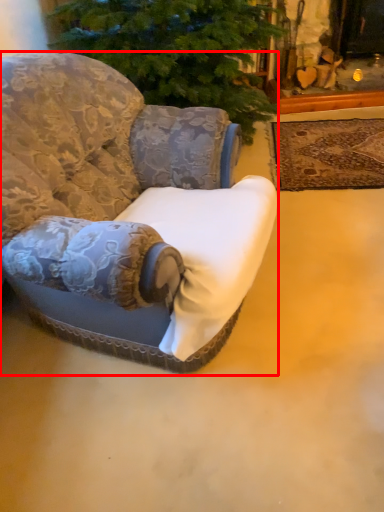
Question: Where is chair (annotated by the red box) located in relation to mat in the image?

Choices:
 (A) right
 (B) left

Answer: (B)